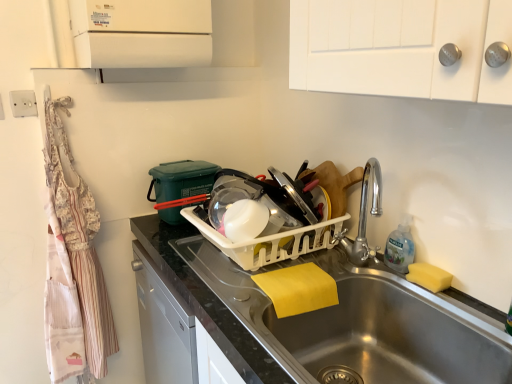
Question: From the image's perspective, is clear plastic bottle at sink right below yellow sponge at sink right?

Choices:
 (A) no
 (B) yes

Answer: (A)

Question: Can you confirm if clear plastic bottle at sink right is taller than yellow sponge at sink right?

Choices:
 (A) no
 (B) yes

Answer: (B)

Question: Would you say clear plastic bottle at sink right contains yellow sponge at sink right?

Choices:
 (A) no
 (B) yes

Answer: (A)

Question: Is clear plastic bottle at sink right far away from yellow sponge at sink right?

Choices:
 (A) yes
 (B) no

Answer: (B)

Question: Can you confirm if clear plastic bottle at sink right is smaller than yellow sponge at sink right?

Choices:
 (A) no
 (B) yes

Answer: (A)

Question: From a real-world perspective, relative to white plastic dish rack at center, is white glossy counter top at center vertically above or below?

Choices:
 (A) above
 (B) below

Answer: (B)

Question: Based on their positions, is white glossy counter top at center located to the left or right of white plastic dish rack at center?

Choices:
 (A) right
 (B) left

Answer: (B)

Question: Is point (229, 324) closer or farther from the camera than point (281, 235)?

Choices:
 (A) closer
 (B) farther

Answer: (A)

Question: Considering the positions of white glossy counter top at center and white plastic dish rack at center in the image, is white glossy counter top at center wider or thinner than white plastic dish rack at center?

Choices:
 (A) wide
 (B) thin

Answer: (A)

Question: Is clear plastic bottle at sink right taller or shorter than white plastic dish rack at center?

Choices:
 (A) short
 (B) tall

Answer: (B)

Question: Is clear plastic bottle at sink right in front of or behind white plastic dish rack at center in the image?

Choices:
 (A) front
 (B) behind

Answer: (B)

Question: Based on their positions, is clear plastic bottle at sink right located to the left or right of white plastic dish rack at center?

Choices:
 (A) right
 (B) left

Answer: (A)

Question: Based on their sizes in the image, would you say clear plastic bottle at sink right is bigger or smaller than white plastic dish rack at center?

Choices:
 (A) small
 (B) big

Answer: (A)

Question: From the image's perspective, is white plastic dish rack at center positioned above or below clear plastic bottle at sink right?

Choices:
 (A) above
 (B) below

Answer: (A)

Question: From a real-world perspective, is white plastic dish rack at center positioned above or below clear plastic bottle at sink right?

Choices:
 (A) above
 (B) below

Answer: (B)